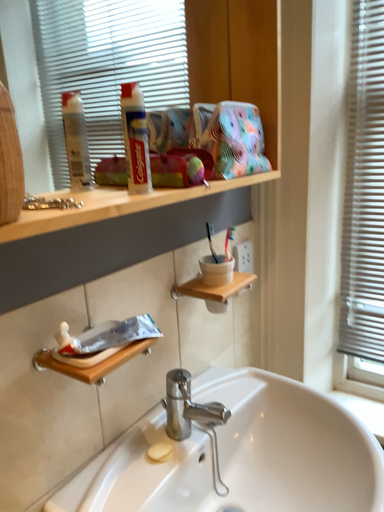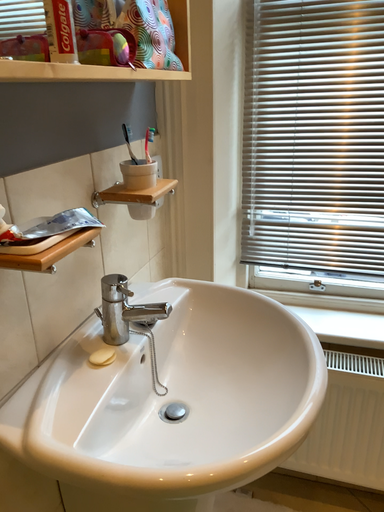
Question: How did the camera likely rotate when shooting the video?

Choices:
 (A) rotated right
 (B) rotated left

Answer: (A)